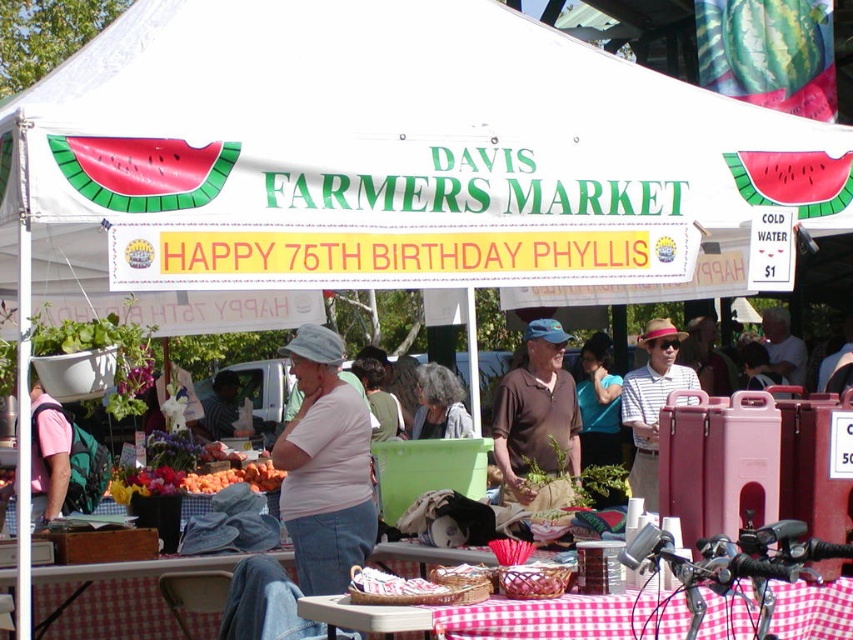
Is white fabric canopy at upper center above checkered fabric tablecloth at lower center?

Yes.

Does white fabric canopy at upper center have a lesser height compared to checkered fabric tablecloth at lower center?

In fact, white fabric canopy at upper center may be taller than checkered fabric tablecloth at lower center.

You are a GUI agent. You are given a task and a screenshot of the screen. Output one action in this format:
    pyautogui.click(x=<x>, y=<y>)
    Task: Click on the white fabric canopy at upper center
    This screenshot has width=853, height=640.
    Given the screenshot: What is the action you would take?
    pyautogui.click(x=416, y=120)

Who is higher up, brown cotton shirt at center or blue fabric shirt at center?

brown cotton shirt at center

Consider the image. Does brown cotton shirt at center have a lesser height compared to blue fabric shirt at center?

Correct, brown cotton shirt at center is not as tall as blue fabric shirt at center.

Is point (521, 460) closer to viewer compared to point (596, 358)?

Yes, it is.

Where is `brown cotton shirt at center`? Image resolution: width=853 pixels, height=640 pixels. brown cotton shirt at center is located at coordinates (537, 417).

Is brown cotton shirt at center bigger than gray hair at center?

Indeed, brown cotton shirt at center has a larger size compared to gray hair at center.

Is brown cotton shirt at center shorter than gray hair at center?

No.

Does point (537, 340) come farther from viewer compared to point (457, 400)?

That is True.

The image size is (853, 640). Find the location of `brown cotton shirt at center`. brown cotton shirt at center is located at coordinates (537, 417).